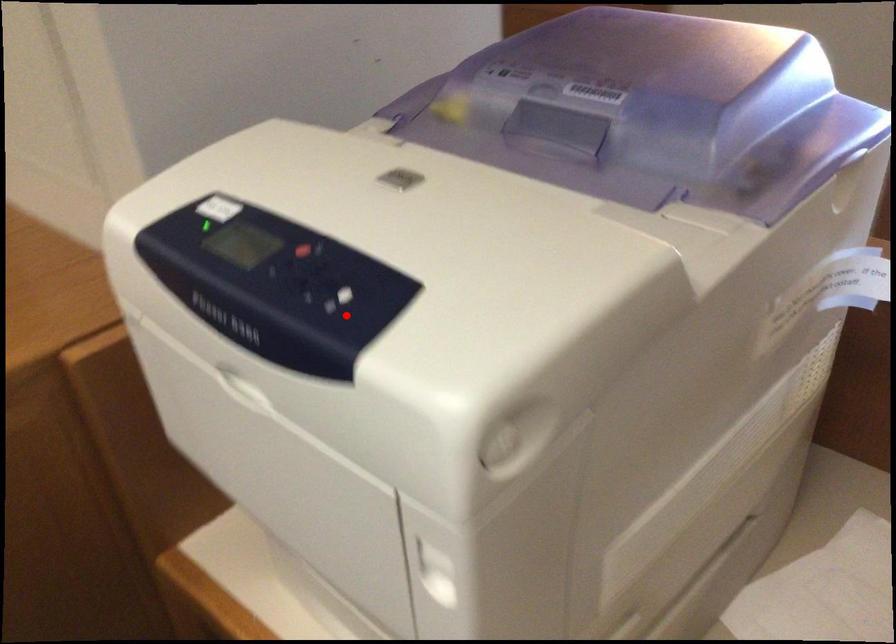
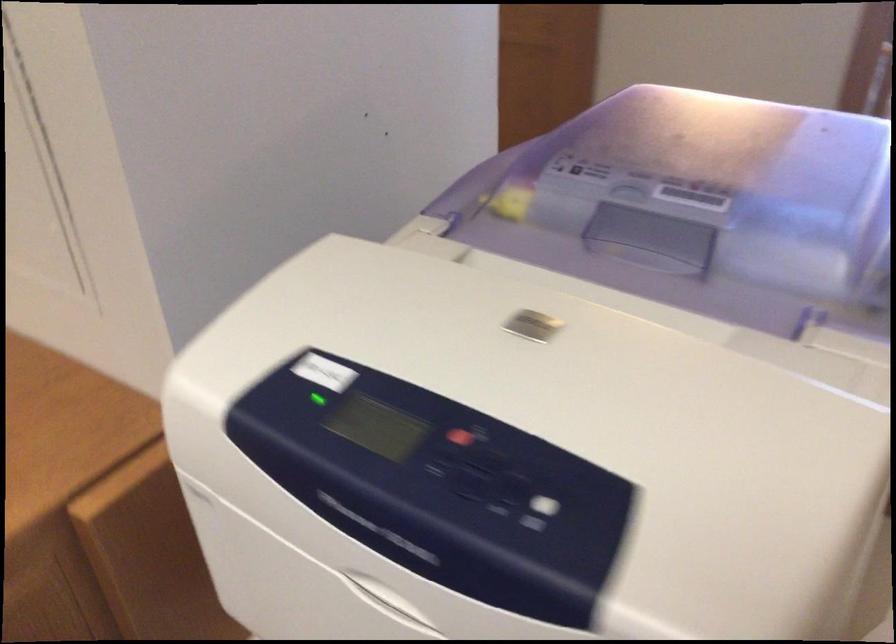
Question: I am providing you with two images of the same scene from different viewpoints. Given a red point in image1, look at the same physical point in image2. Is it:

Choices:
 (A) Closer to the viewpoint
 (B) Farther from the viewpoint

Answer: (A)